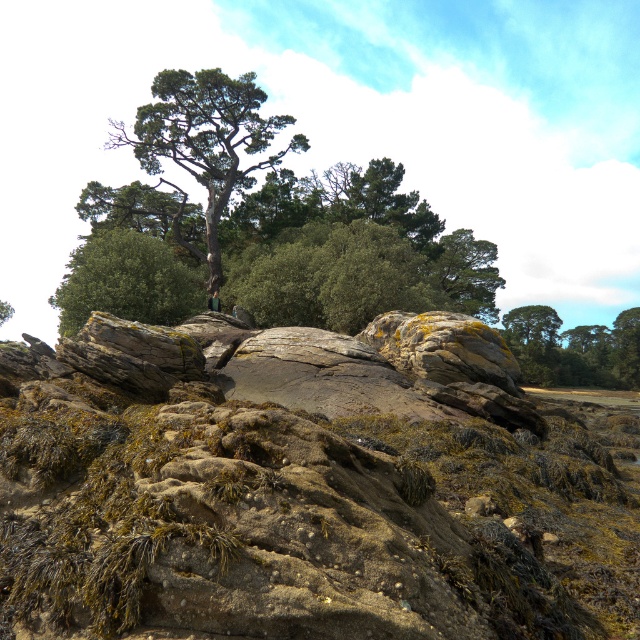
You are a GUI agent. You are given a task and a screenshot of the screen. Output one action in this format:
    pyautogui.click(x=<x>, y=<y>)
    Task: Click on the mossy rock at center
    
    Given the screenshot: What is the action you would take?
    pyautogui.click(x=307, y=486)

Is green rough bark tree at center smaller than green rough bark tree at upper center?

No, green rough bark tree at center is not smaller than green rough bark tree at upper center.

The height and width of the screenshot is (640, 640). Find the location of `green rough bark tree at center`. green rough bark tree at center is located at coordinates (205, 141).

Does point (113, 138) come in front of point (486, 262)?

Yes, it is in front of point (486, 262).

Locate an element on the screen. This screenshot has height=640, width=640. green rough bark tree at center is located at coordinates (205, 141).

In the scene shown: Who is more distant from viewer, [296,148] or [109,288]?

The point [296,148] is behind.

Who is more distant from viewer, (228, 125) or (129, 298)?

The point (228, 125) is more distant.

In order to click on green rough bark tree at center in this screenshot , I will do [205, 141].